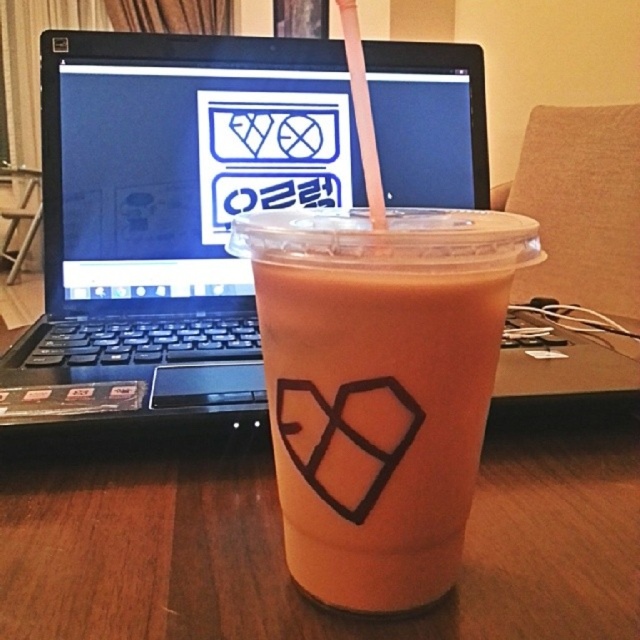
Question: Does black plastic laptop at center have a larger size compared to transparent plastic straw at upper center?

Choices:
 (A) no
 (B) yes

Answer: (B)

Question: Can you confirm if translucent plastic cup at center is wider than transparent plastic straw at upper center?

Choices:
 (A) yes
 (B) no

Answer: (A)

Question: Which object appears farthest from the camera in this image?

Choices:
 (A) transparent plastic straw at upper center
 (B) black plastic laptop at center

Answer: (B)

Question: Which is nearer to the black plastic laptop at center?

Choices:
 (A) translucent plastic cup at center
 (B) transparent plastic straw at upper center

Answer: (B)

Question: Can you confirm if translucent plastic cup at center is positioned to the left of transparent plastic straw at upper center?

Choices:
 (A) no
 (B) yes

Answer: (B)

Question: Which point is closer to the camera taking this photo?

Choices:
 (A) (346, 378)
 (B) (387, 124)
 (C) (342, 17)

Answer: (A)